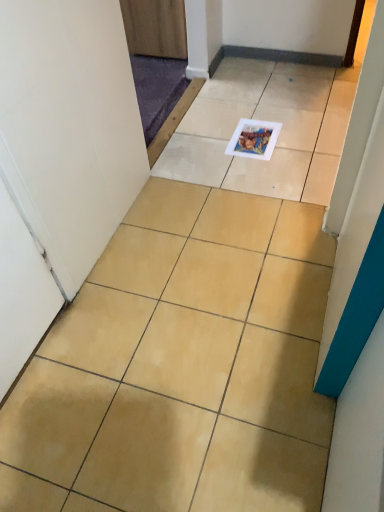
Question: Looking at their shapes, would you say wooden door at upper center is wider or thinner than matte plastic magazine at center?

Choices:
 (A) thin
 (B) wide

Answer: (B)

Question: Is wooden door at upper center in front of or behind matte plastic magazine at center in the image?

Choices:
 (A) front
 (B) behind

Answer: (B)

Question: Estimate the real-world distances between objects in this image. Which object is closer to the wooden door at upper center?

Choices:
 (A) matte plastic magazine at center
 (B) beige ceramic tile at center

Answer: (A)

Question: Which of these objects is positioned closest to the wooden door at upper center?

Choices:
 (A) beige ceramic tile at center
 (B) matte plastic magazine at center

Answer: (B)